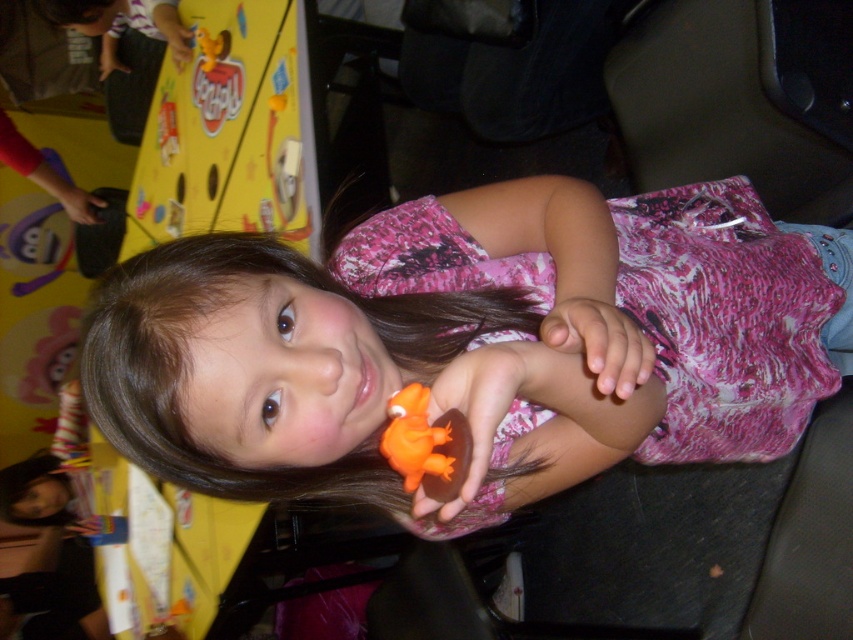
Based on the scene description, where is the orange rubber duck at center located in terms of coordinates?

The orange rubber duck at center is located at coordinates point (474,412).

You are a photographer trying to capture a closeup shot of the pink matte hand at center. The camera you are using has a minimum focusing distance of 50 centimeters. Can you take the photo without moving the camera closer?

The pink matte hand at center is 47.35 centimeters from the viewer, which is closer than the camera minimum focusing distance of 50 centimeters. Therefore, the photographer cannot take the photo without moving the camera closer.

You are standing in the play area and see two points marked in the image. Which point is closer to you, point (619, 353) or point (395, 394)?

Point (619, 353) is in front of point (395, 394), so it is closer to you.